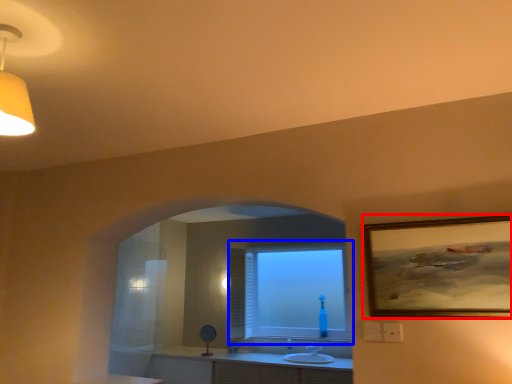
Question: Which of the following is the closest to the observer, picture frame (highlighted by a red box) or window (highlighted by a blue box)?

Choices:
 (A) picture frame
 (B) window

Answer: (A)